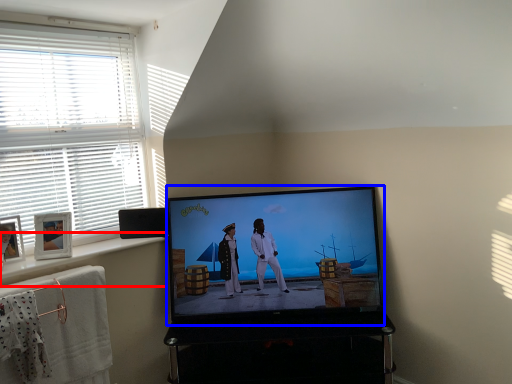
Question: Which object appears closest to the camera in this image, window sill (highlighted by a red box) or television (highlighted by a blue box)?

Choices:
 (A) window sill
 (B) television

Answer: (A)